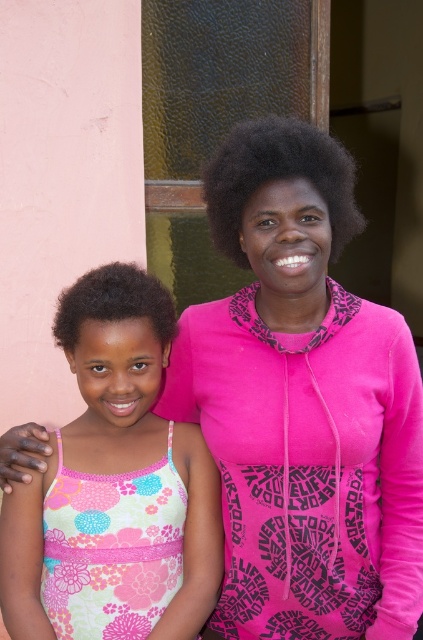
You are an AI analyzing the composition of the image. The scene has a young girl and an adult standing outdoors. Where is the floral fabric dress at center located in terms of coordinates?

The floral fabric dress at center is located at coordinates point (139,419).

Based on the coordinates provided, which object is located at point (139, 419)?

The floral fabric dress at center is located at point (139, 419).